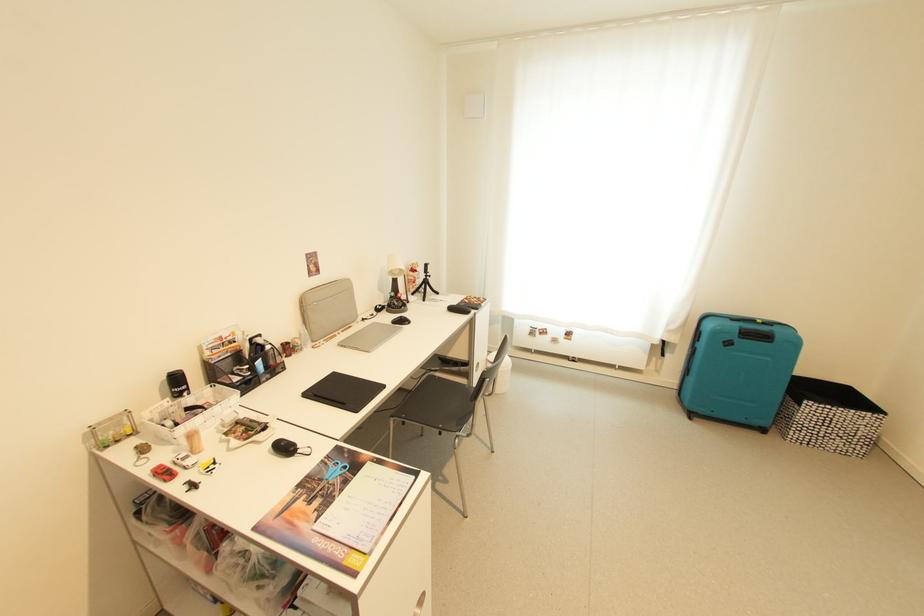
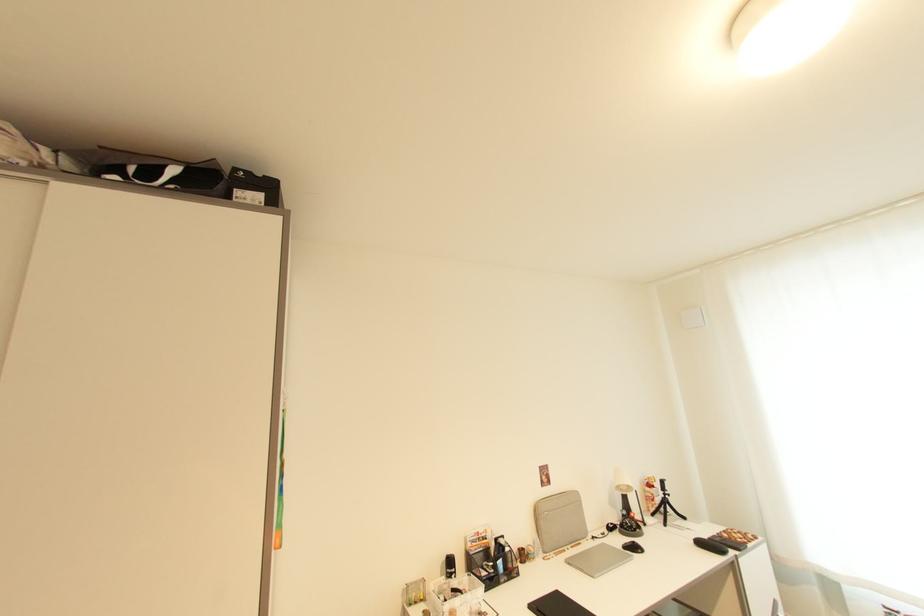
How did the camera likely rotate?

The camera rotated toward left-up.